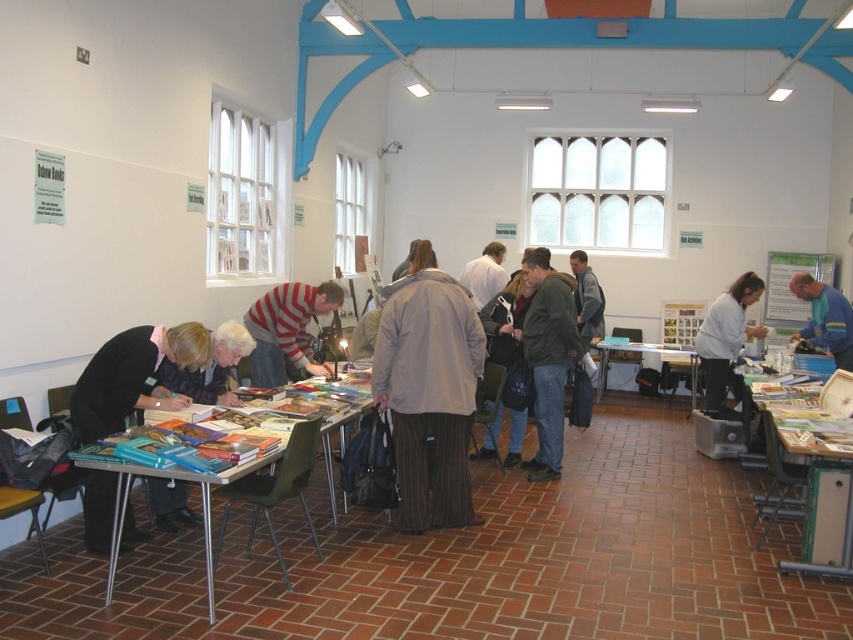
You are at the book fair and want to reach the smooth beige coat at center without stepping on the white matte jacket at lower right. Which direction should you move from your current position, assuming you are standing to the left of both items?

You should move to the left because the white matte jacket at lower right is to the right of the smooth beige coat at center, so moving left will keep you away from the jacket while approaching the coat.

You are standing in the middle of the community hall and see the light beige jacket at center and the metallic silver table at center. Which object is nearer to you?

The light beige jacket at center is closer to the viewer than the metallic silver table at center, so the light beige jacket at center is nearer to you.

You are organizing a book fair and need to ensure there is enough space between the light beige jacket at center and the metallic silver table at center for attendees to move comfortably. According to safety guidelines, a minimum of 5 meters is required between such items. Is the current distance sufficient?

The light beige jacket at center and metallic silver table at center are 4.92 meters apart from each other, which is slightly less than the required 5 meters. Therefore, the current distance is not sufficient to meet the safety guidelines.